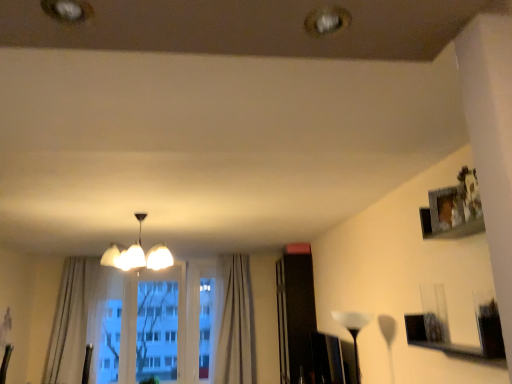
This screenshot has height=384, width=512. What do you see at coordinates (137, 254) in the screenshot?
I see `white glossy chandelier at center, placed as the second lamp when sorted from right to left` at bounding box center [137, 254].

The image size is (512, 384). Describe the element at coordinates (146, 320) in the screenshot. I see `transparent glass window at center` at that location.

This screenshot has width=512, height=384. I want to click on white translucent lampshade at center, the 2th lamp from the top, so click(353, 330).

I want to click on light beige fabric curtain at left, acting as the second curtain starting from the right, so click(x=77, y=320).

Which is correct: light beige fabric curtain at left, the first curtain from the left, is inside white glossy chandelier at center, the 1th lamp positioned from the left, or outside of it?

light beige fabric curtain at left, the first curtain from the left, exists outside the volume of white glossy chandelier at center, the 1th lamp positioned from the left.

Does light beige fabric curtain at left, the first curtain from the left, have a lesser width compared to white glossy chandelier at center, the 1th lamp positioned from the left?

Yes, light beige fabric curtain at left, the first curtain from the left, is thinner than white glossy chandelier at center, the 1th lamp positioned from the left.

From a real-world perspective, who is located lower, light beige fabric curtain at left, acting as the second curtain starting from the right, or white glossy chandelier at center, the 1th lamp positioned from the left?

light beige fabric curtain at left, acting as the second curtain starting from the right.

In the scene shown: Between light beige fabric curtain at left, acting as the second curtain starting from the right, and white glossy chandelier at center, the second lamp from the bottom, which one has more height?

Standing taller between the two is light beige fabric curtain at left, acting as the second curtain starting from the right.

Considering the relative sizes of white translucent lampshade at center, placed as the 1th lamp when sorted from bottom to top, and light beige textured curtain at center, which appears as the second curtain when viewed from the left, in the image provided, is white translucent lampshade at center, placed as the 1th lamp when sorted from bottom to top, shorter than light beige textured curtain at center, which appears as the second curtain when viewed from the left,?

Correct, white translucent lampshade at center, placed as the 1th lamp when sorted from bottom to top, is not as tall as light beige textured curtain at center, which appears as the second curtain when viewed from the left.

In the image, is white translucent lampshade at center, positioned as the 2th lamp in left-to-right order, positioned in front of or behind light beige textured curtain at center, the 1th curtain viewed from the right?

white translucent lampshade at center, positioned as the 2th lamp in left-to-right order, is in front of light beige textured curtain at center, the 1th curtain viewed from the right.

Between point (357, 374) and point (238, 308), which one is positioned in front?

The point (357, 374) is closer to the camera.

Is white translucent lampshade at center, positioned as the 2th lamp in left-to-right order, to the left or to the right of light beige textured curtain at center, the 1th curtain viewed from the right, in the image?

white translucent lampshade at center, positioned as the 2th lamp in left-to-right order, is to the right of light beige textured curtain at center, the 1th curtain viewed from the right.

Is white glossy chandelier at center, the first lamp positioned from the top, touching light beige fabric curtain at left, the first curtain from the left?

No, white glossy chandelier at center, the first lamp positioned from the top, is not beside light beige fabric curtain at left, the first curtain from the left.

Which is closer, (142, 258) or (62, 376)?

Point (142, 258) appears to be closer to the viewer than point (62, 376).

Is white glossy chandelier at center, the second lamp from the bottom, inside or outside of light beige fabric curtain at left, acting as the second curtain starting from the right?

white glossy chandelier at center, the second lamp from the bottom, lies outside light beige fabric curtain at left, acting as the second curtain starting from the right.

Is white glossy chandelier at center, the 1th lamp positioned from the left, positioned with its back to light beige fabric curtain at left, the first curtain from the left?

No, light beige fabric curtain at left, the first curtain from the left, is not at the back of white glossy chandelier at center, the 1th lamp positioned from the left.

Which of these two, light beige textured curtain at center, which appears as the second curtain when viewed from the left, or white glossy chandelier at center, the second lamp from the bottom, stands taller?

Standing taller between the two is light beige textured curtain at center, which appears as the second curtain when viewed from the left.

Is white glossy chandelier at center, the 1th lamp positioned from the left, surrounded by light beige textured curtain at center, which appears as the second curtain when viewed from the left?

Definitely not — white glossy chandelier at center, the 1th lamp positioned from the left, is not inside light beige textured curtain at center, which appears as the second curtain when viewed from the left.

Can you tell me how much light beige textured curtain at center, the 1th curtain viewed from the right, and white glossy chandelier at center, the first lamp positioned from the top, differ in facing direction?

The angular difference between light beige textured curtain at center, the 1th curtain viewed from the right, and white glossy chandelier at center, the first lamp positioned from the top, is 176 degrees.

Can you confirm if light beige textured curtain at center, the 1th curtain viewed from the right, is thinner than white glossy chandelier at center, the first lamp positioned from the top?

Correct, the width of light beige textured curtain at center, the 1th curtain viewed from the right, is less than that of white glossy chandelier at center, the first lamp positioned from the top.

Which object is positioned more to the left, transparent glass window at center or light beige textured curtain at center, the 1th curtain viewed from the right?

transparent glass window at center is more to the left.

From a real-world perspective, is transparent glass window at center positioned under light beige textured curtain at center, which appears as the second curtain when viewed from the left, based on gravity?

Correct, in the physical world, transparent glass window at center is lower than light beige textured curtain at center, which appears as the second curtain when viewed from the left.

Can you confirm if transparent glass window at center is bigger than light beige textured curtain at center, which appears as the second curtain when viewed from the left?

Actually, transparent glass window at center might be smaller than light beige textured curtain at center, which appears as the second curtain when viewed from the left.

From the image's perspective, relative to light beige textured curtain at center, which appears as the second curtain when viewed from the left, is transparent glass window at center above or below?

transparent glass window at center is below light beige textured curtain at center, which appears as the second curtain when viewed from the left.

Between white translucent lampshade at center, which is the 1th lamp from right to left, and transparent glass window at center, which one has less height?

Standing shorter between the two is white translucent lampshade at center, which is the 1th lamp from right to left.

From the picture: Can you confirm if white translucent lampshade at center, which is the 1th lamp from right to left, is positioned to the right of transparent glass window at center?

Yes, white translucent lampshade at center, which is the 1th lamp from right to left, is to the right of transparent glass window at center.

Looking at their sizes, would you say white translucent lampshade at center, the 2th lamp from the top, is wider or thinner than transparent glass window at center?

In the image, white translucent lampshade at center, the 2th lamp from the top, appears to be wider than transparent glass window at center.

From a real-world perspective, is white translucent lampshade at center, the 2th lamp from the top, physically located above or below transparent glass window at center?

From a real-world perspective, white translucent lampshade at center, the 2th lamp from the top, is physically below transparent glass window at center.

Looking at the image, does transparent glass window at center seem bigger or smaller compared to white glossy chandelier at center, the 1th lamp positioned from the left?

transparent glass window at center is smaller than white glossy chandelier at center, the 1th lamp positioned from the left.

In the scene shown: From the image's perspective, which is below, transparent glass window at center or white glossy chandelier at center, the first lamp positioned from the top?

transparent glass window at center is shown below in the image.

Considering the relative positions of transparent glass window at center and white glossy chandelier at center, the second lamp from the bottom, in the image provided, is transparent glass window at center to the right of white glossy chandelier at center, the second lamp from the bottom, from the viewer's perspective?

Incorrect, transparent glass window at center is not on the right side of white glossy chandelier at center, the second lamp from the bottom.

Identify the location of lamp above the light beige fabric curtain at left, acting as the second curtain starting from the right (from a real-world perspective). (137, 254).

Locate an element on the screen. The height and width of the screenshot is (384, 512). the 2nd curtain behind the white translucent lampshade at center, which is the 1th lamp from right to left is located at coordinates (234, 322).

Which object lies nearer to the anchor point transparent glass window at center, light beige textured curtain at center, the 1th curtain viewed from the right, or white translucent lampshade at center, the 2th lamp from the top?

light beige textured curtain at center, the 1th curtain viewed from the right, is positioned closer to the anchor transparent glass window at center.

From the picture: Looking at the image, which one is located further to white translucent lampshade at center, the 2th lamp from the top, light beige textured curtain at center, the 1th curtain viewed from the right, or light beige fabric curtain at left, the first curtain from the left?

light beige fabric curtain at left, the first curtain from the left, lies further to white translucent lampshade at center, the 2th lamp from the top, than the other object.

When comparing their distances from white translucent lampshade at center, placed as the 1th lamp when sorted from bottom to top, does transparent glass window at center or white glossy chandelier at center, the first lamp positioned from the top, seem further?

transparent glass window at center is positioned further to the anchor white translucent lampshade at center, placed as the 1th lamp when sorted from bottom to top.

Considering their positions, is white glossy chandelier at center, placed as the second lamp when sorted from right to left, positioned closer to transparent glass window at center than light beige fabric curtain at left, acting as the second curtain starting from the right?

light beige fabric curtain at left, acting as the second curtain starting from the right, is closer to transparent glass window at center.

From the image, which object appears to be farther from transparent glass window at center, white translucent lampshade at center, positioned as the 2th lamp in left-to-right order, or light beige textured curtain at center, the 1th curtain viewed from the right?

The object further to transparent glass window at center is white translucent lampshade at center, positioned as the 2th lamp in left-to-right order.

When comparing their distances from light beige fabric curtain at left, the first curtain from the left, does light beige textured curtain at center, the 1th curtain viewed from the right, or white glossy chandelier at center, the second lamp from the bottom, seem closer?

Based on the image, white glossy chandelier at center, the second lamp from the bottom, appears to be nearer to light beige fabric curtain at left, the first curtain from the left.

Considering their positions, is light beige textured curtain at center, the 1th curtain viewed from the right, positioned further to white glossy chandelier at center, placed as the second lamp when sorted from right to left, than transparent glass window at center?

transparent glass window at center is positioned further to the anchor white glossy chandelier at center, placed as the second lamp when sorted from right to left.

Based on their spatial positions, is transparent glass window at center or white translucent lampshade at center, which is the 1th lamp from right to left, further from white glossy chandelier at center, the first lamp positioned from the top?

Based on the image, white translucent lampshade at center, which is the 1th lamp from right to left, appears to be further to white glossy chandelier at center, the first lamp positioned from the top.

Find the location of `lamp between white glossy chandelier at center, the first lamp positioned from the top, and transparent glass window at center in the front-back direction`. lamp between white glossy chandelier at center, the first lamp positioned from the top, and transparent glass window at center in the front-back direction is located at coordinates (353, 330).

Image resolution: width=512 pixels, height=384 pixels. What are the coordinates of `curtain between light beige fabric curtain at left, the first curtain from the left, and white translucent lampshade at center, positioned as the 2th lamp in left-to-right order` in the screenshot? It's located at (234, 322).

Identify the location of bay window between light beige fabric curtain at left, acting as the second curtain starting from the right, and white translucent lampshade at center, placed as the 1th lamp when sorted from bottom to top, from left to right. (146, 320).

This screenshot has width=512, height=384. In order to click on lamp between light beige fabric curtain at left, the first curtain from the left, and white translucent lampshade at center, positioned as the 2th lamp in left-to-right order in this screenshot , I will do `click(137, 254)`.